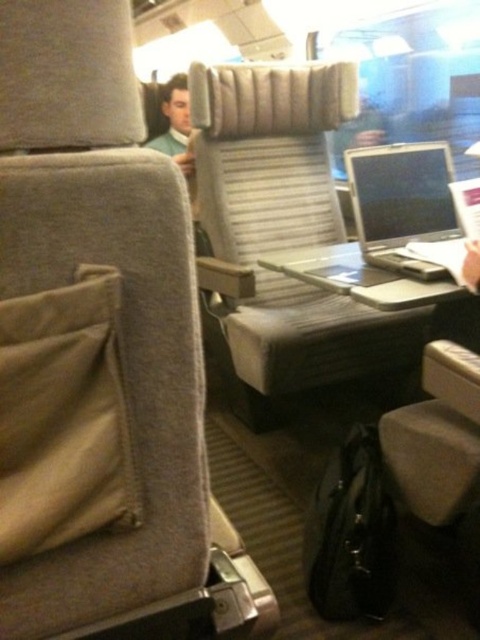
In the scene shown: Can you confirm if satin silver laptop at center is thinner than metallic gray tray at center?

Yes, satin silver laptop at center is thinner than metallic gray tray at center.

Consider the image. Does satin silver laptop at center have a greater height compared to metallic gray tray at center?

Yes, satin silver laptop at center is taller than metallic gray tray at center.

The width and height of the screenshot is (480, 640). What do you see at coordinates (403, 204) in the screenshot?
I see `satin silver laptop at center` at bounding box center [403, 204].

Where is `satin silver laptop at center`? Image resolution: width=480 pixels, height=640 pixels. satin silver laptop at center is located at coordinates (403, 204).